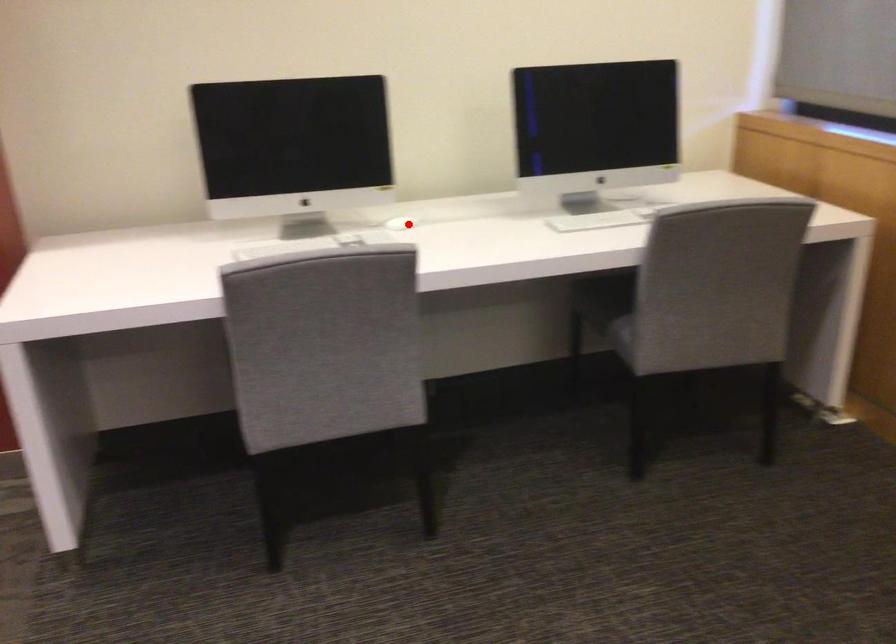
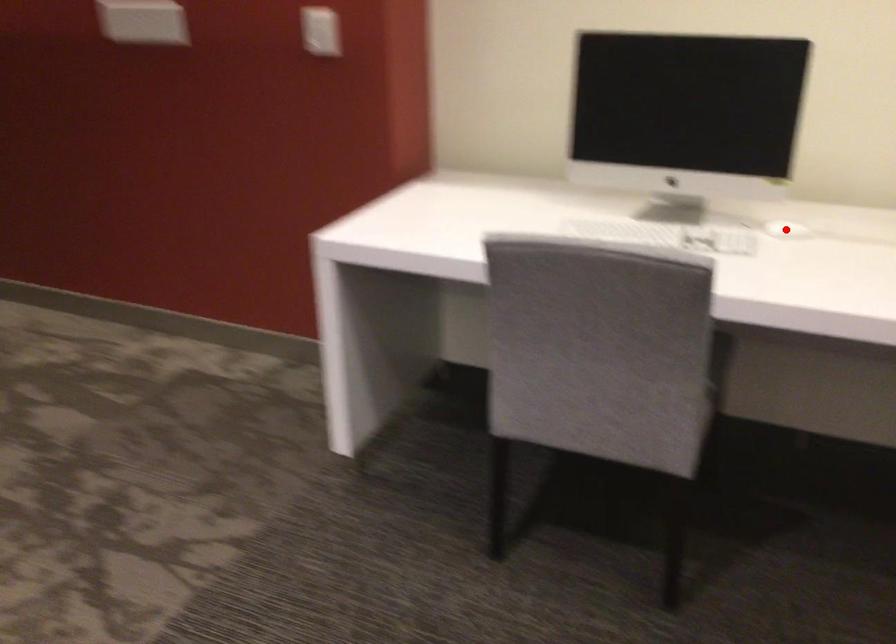
I am providing you with two images of the same scene from different viewpoints. A red point is marked on the first image and another point is marked on the second image. Do the highlighted points in image1 and image2 indicate the same real-world spot?

Yes